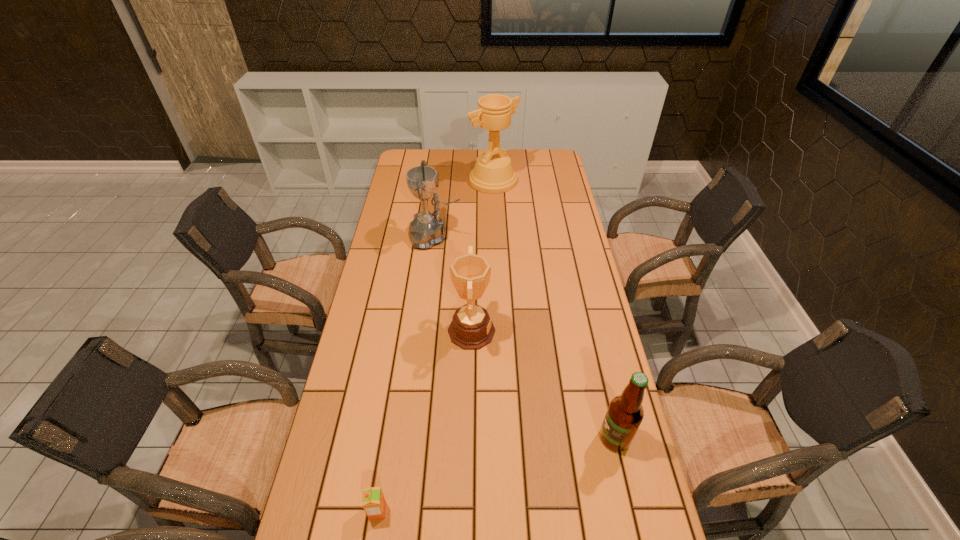
This screenshot has height=540, width=960. In order to click on free space between the beer bottle and the tallest award in this screenshot , I will do `click(554, 309)`.

You are a GUI agent. You are given a task and a screenshot of the screen. Output one action in this format:
    pyautogui.click(x=<x>, y=<y>)
    Task: Click on the empty space that is in between the tallest award and the shortest object
    
    Given the screenshot: What is the action you would take?
    pyautogui.click(x=436, y=346)

At what (x,y) coordinates should I click in order to perform the action: click on the fourth closest object relative to the tallest award. Please return your answer as a coordinate pair (x, y). Looking at the image, I should click on (374, 504).

Image resolution: width=960 pixels, height=540 pixels. I want to click on object that is the second closest to the fourth nearest object, so click(x=471, y=328).

Identify which award is located as the nearest to the tallest object. Please provide its 2D coordinates. Your answer should be formatted as a tuple, i.e. [(x, y)], where the tuple contains the x and y coordinates of a point satisfying the conditions above.

[(427, 229)]

Select which award is the second closest to the farthest award. Please provide its 2D coordinates. Your answer should be formatted as a tuple, i.e. [(x, y)], where the tuple contains the x and y coordinates of a point satisfying the conditions above.

[(471, 328)]

Image resolution: width=960 pixels, height=540 pixels. Find the location of `vacant point that satisfies the following two spatial constraints: 1. on the front side of the farthest object; 2. on the side with emblem of the second farthest award`. vacant point that satisfies the following two spatial constraints: 1. on the front side of the farthest object; 2. on the side with emblem of the second farthest award is located at coordinates (495, 237).

Find the location of a particular element. Image resolution: width=960 pixels, height=540 pixels. free space that satisfies the following two spatial constraints: 1. on the front side of the tallest award; 2. on the side with emblem of the second farthest award is located at coordinates (495, 237).

Find the location of `vacant area that satisfies the following two spatial constraints: 1. on the side with emblem of the second farthest object; 2. on the front side of the orange juice`. vacant area that satisfies the following two spatial constraints: 1. on the side with emblem of the second farthest object; 2. on the front side of the orange juice is located at coordinates (403, 511).